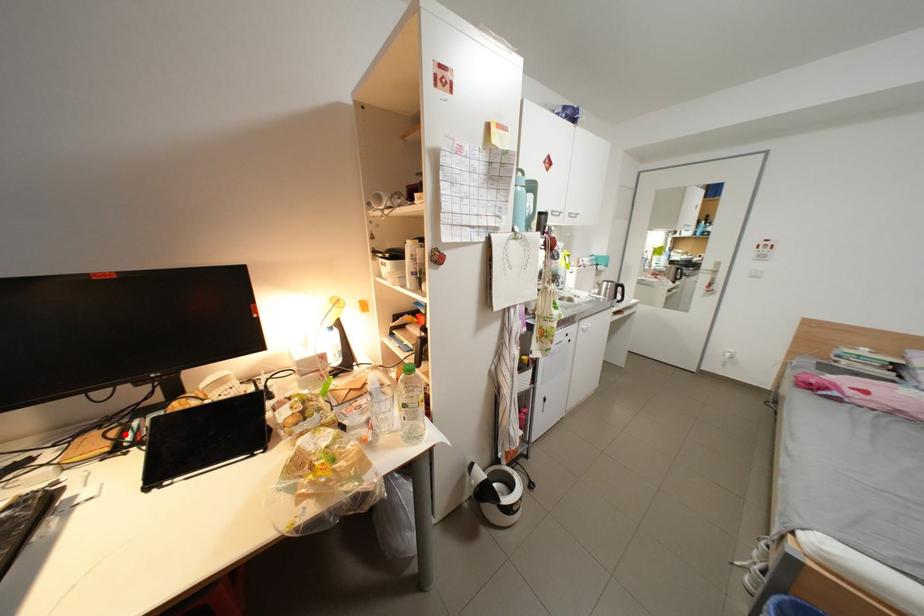
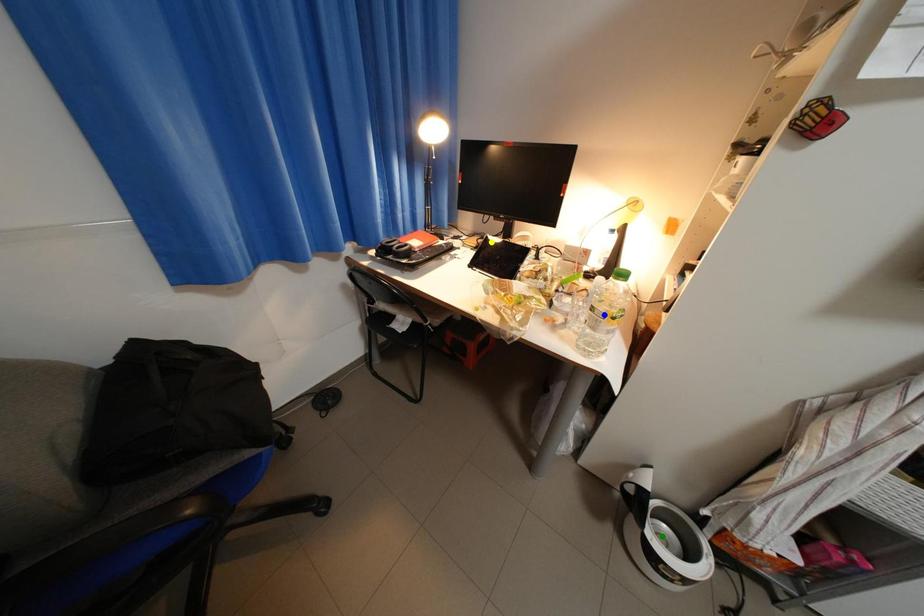
Question: I am providing you with two images of the same scene from different viewpoints. A red point is marked on the first image. You are given multiple points on the second image. Which spot in image 2 lines up with the point in image 1?

Choices:
 (A) yellow point
 (B) blue point
 (C) green point

Answer: (A)